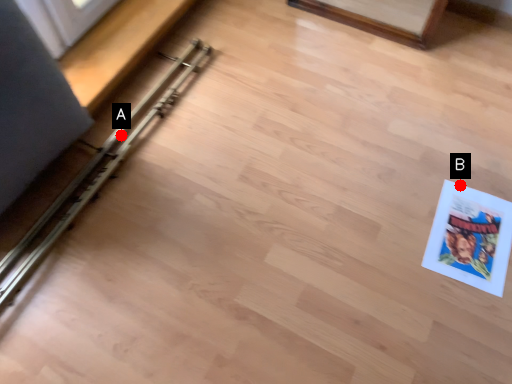
Question: Two points are circled on the image, labeled by A and B beside each circle. Which point is farther from the camera taking this photo?

Choices:
 (A) A is further
 (B) B is further

Answer: (A)